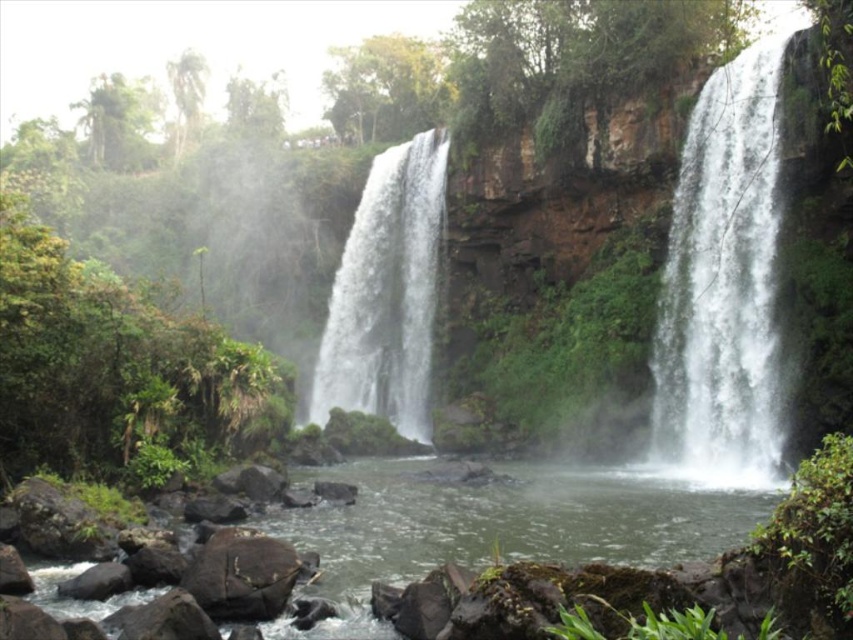
Between brown rough rock at lower left and gray rock at lower left, which one is positioned lower?

gray rock at lower left is lower down.

Is point (241, 541) closer to viewer compared to point (91, 596)?

No, (241, 541) is behind (91, 596).

This screenshot has height=640, width=853. Identify the location of brown rough rock at lower left. (241, 576).

Is white frothy water at right shorter than brown rough rock at lower left?

Incorrect, white frothy water at right's height does not fall short of brown rough rock at lower left's.

Image resolution: width=853 pixels, height=640 pixels. Describe the element at coordinates (723, 285) in the screenshot. I see `white frothy water at right` at that location.

At what (x,y) coordinates should I click in order to perform the action: click on white frothy water at right. Please return your answer as a coordinate pair (x, y). The image size is (853, 640). Looking at the image, I should click on (723, 285).

Between white frothy water at center and brown rough rock at lower left, which one has less height?

Standing shorter between the two is brown rough rock at lower left.

Does point (433, 186) come farther from viewer compared to point (223, 593)?

Yes, it is.

I want to click on white frothy water at center, so click(x=387, y=292).